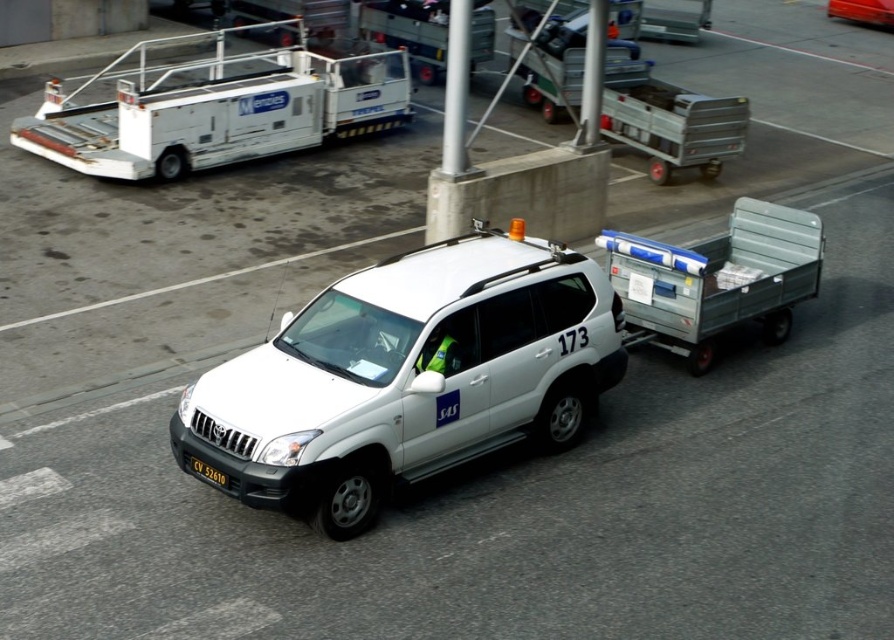
Question: Which of the following is the farthest from the observer?

Choices:
 (A) metallic orange car at upper right
 (B) white matte suv at center
 (C) gray metallic trailer at right
 (D) white plastic baggage cart at upper left

Answer: (A)

Question: Is metallic orange car at upper right to the right of black plastic license plate at lower center from the viewer's perspective?

Choices:
 (A) no
 (B) yes

Answer: (B)

Question: Does metallic orange car at upper right have a greater width compared to black plastic license plate at lower center?

Choices:
 (A) no
 (B) yes

Answer: (B)

Question: Which of these objects is positioned closest to the white matte suv at center?

Choices:
 (A) metallic orange car at upper right
 (B) gray metallic trailer at right
 (C) black plastic license plate at lower center
 (D) white plastic baggage cart at upper left

Answer: (C)

Question: Observing the image, what is the correct spatial positioning of white plastic baggage cart at upper left in reference to gray metallic trailer at right?

Choices:
 (A) left
 (B) right

Answer: (A)

Question: Which of the following is the closest to the observer?

Choices:
 (A) gray metallic trailer at right
 (B) metallic orange car at upper right

Answer: (A)